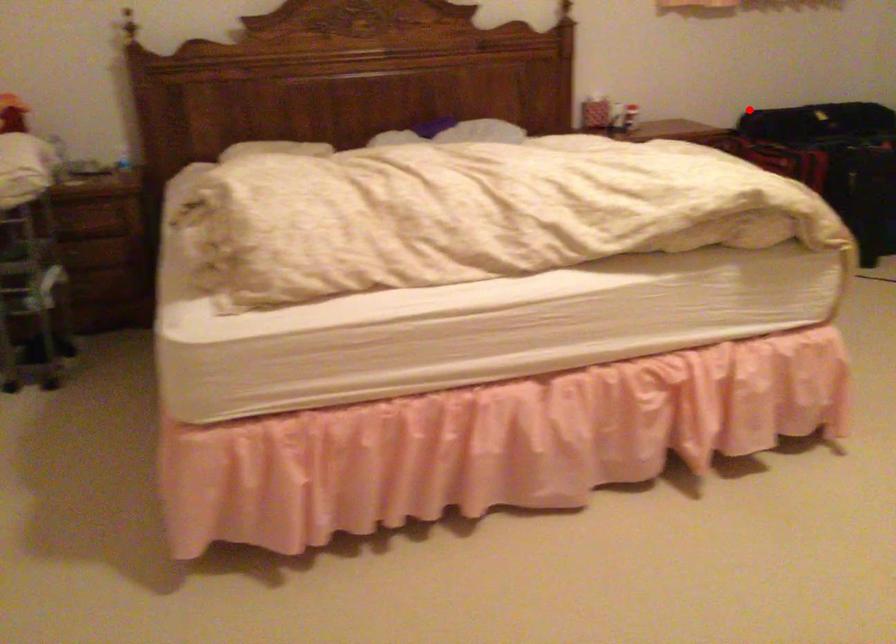
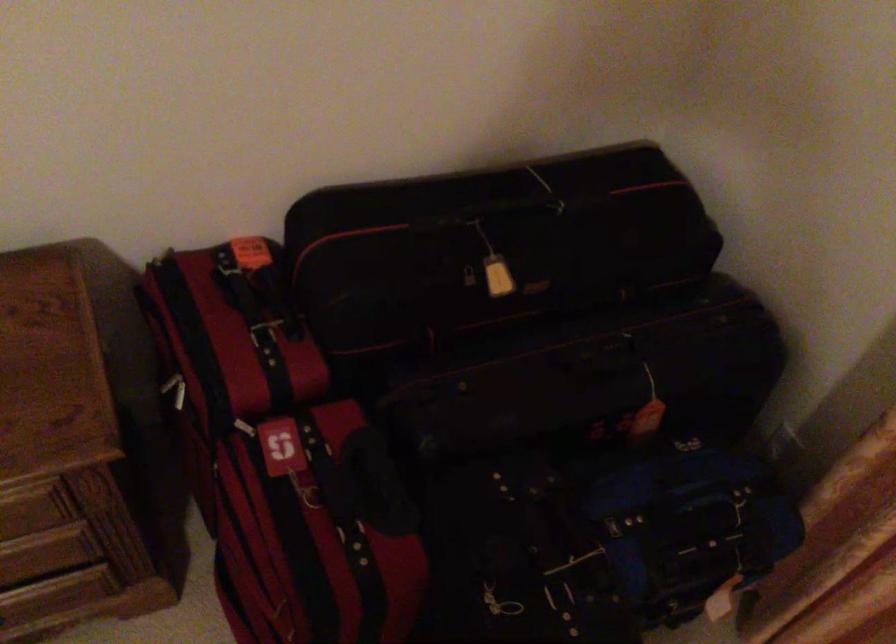
Question: I am providing you with two images of the same scene from different viewpoints. In image1, a red point is highlighted. Considering the same 3D point in image2, which of the following is correct?

Choices:
 (A) It is closer
 (B) It is farther

Answer: (A)